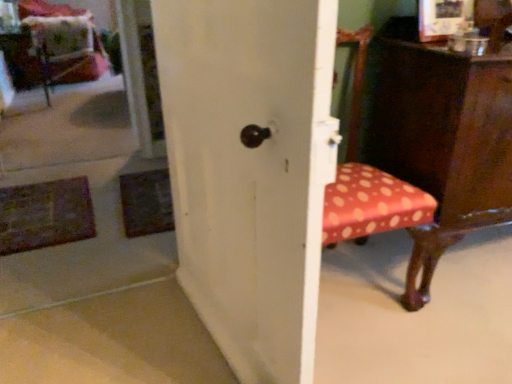
At what (x,y) coordinates should I click in order to perform the action: click on free space below white matte door at center (from a real-world perspective). Please return your answer as a coordinate pair (x, y). The image size is (512, 384). Looking at the image, I should click on (202, 336).